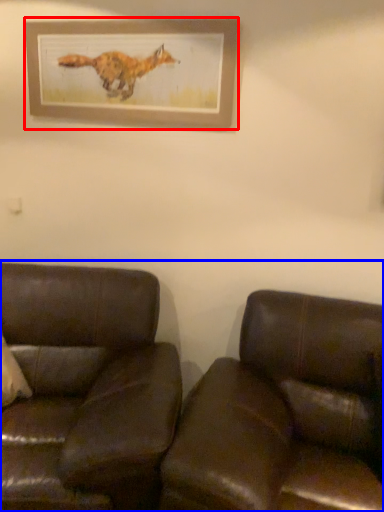
Question: Which object is closer to the camera taking this photo, picture frame (highlighted by a red box) or studio couch (highlighted by a blue box)?

Choices:
 (A) picture frame
 (B) studio couch

Answer: (B)